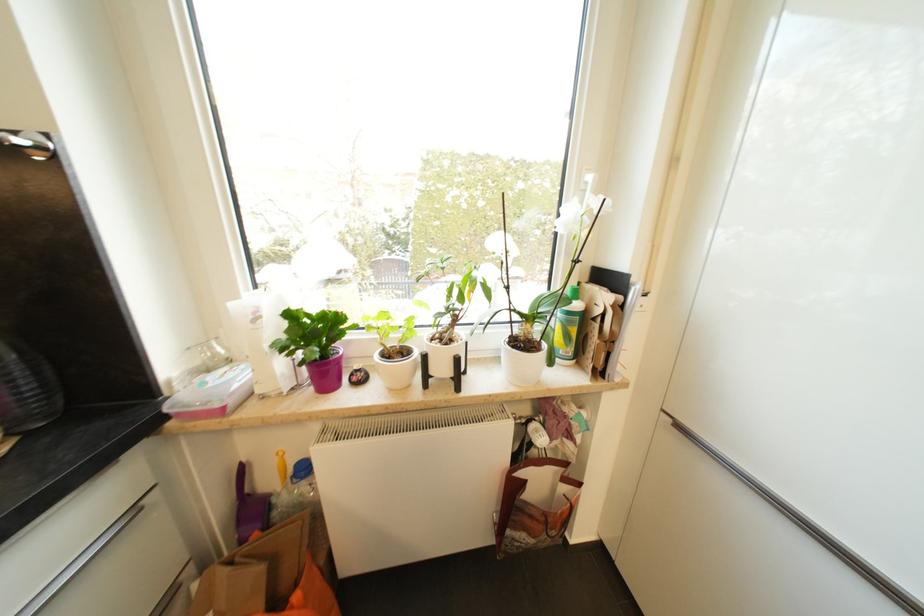
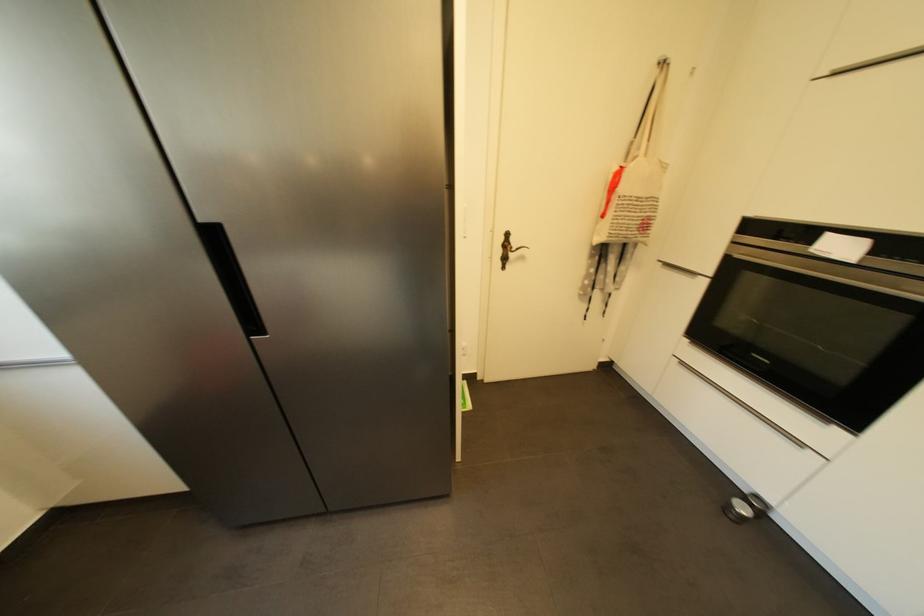
Based on the continuous images, in which direction is the camera rotating?

The camera rotated toward right-down.